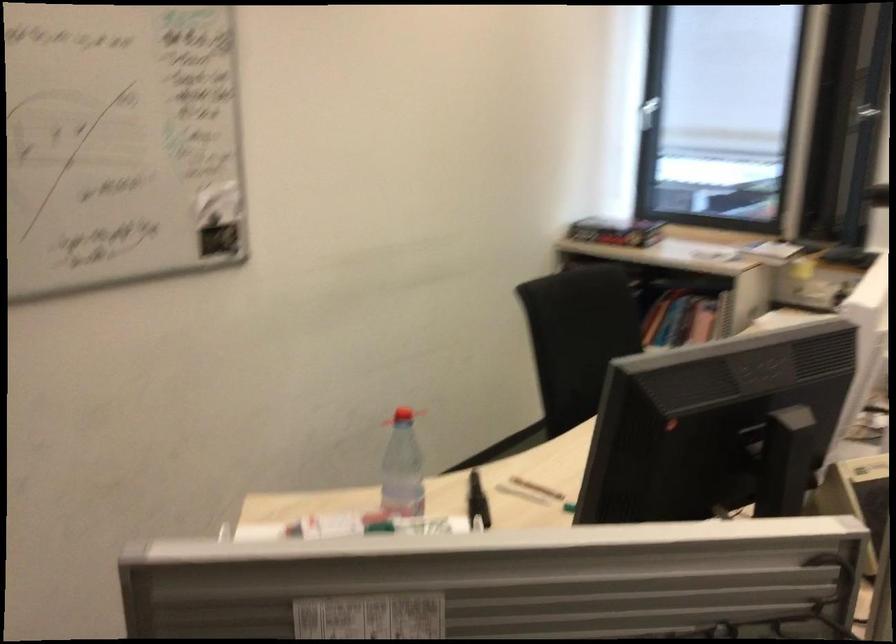
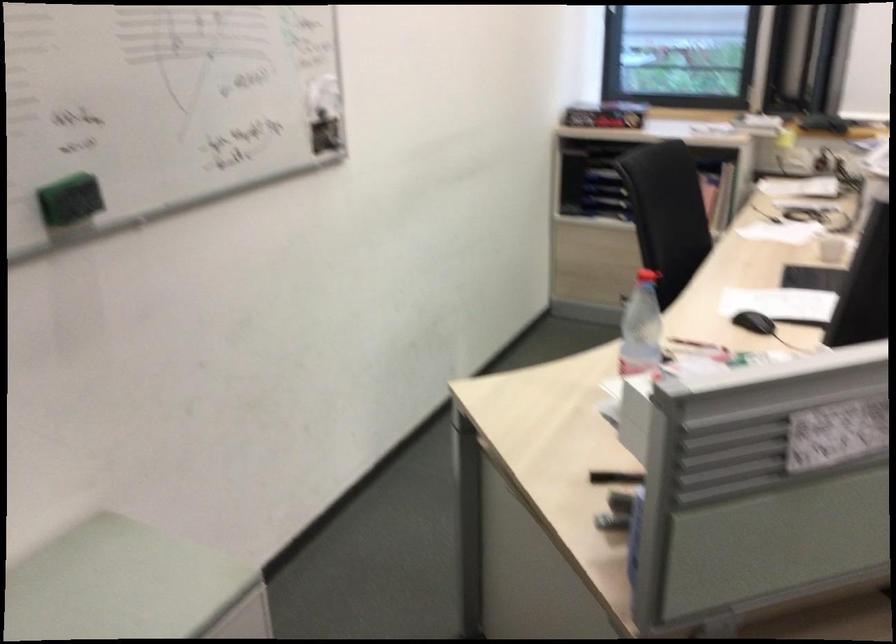
Question: The camera is either moving clockwise (left) or counter-clockwise (right) around the object. The first image is from the beginning of the video and the second image is from the end. Is the camera moving left or right when shooting the video?

Choices:
 (A) Left
 (B) Right

Answer: (A)